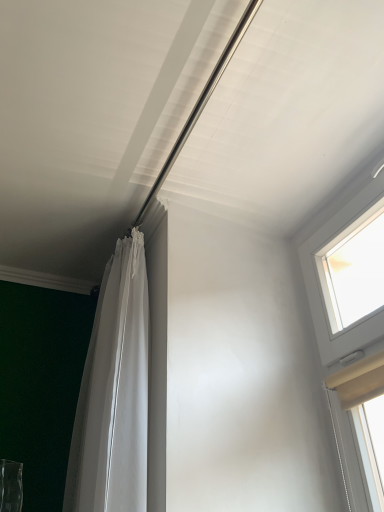
Measure the distance between white sheer curtain at left and camera.

white sheer curtain at left and camera are 36.81 inches apart.

The height and width of the screenshot is (512, 384). Describe the element at coordinates (114, 393) in the screenshot. I see `white sheer curtain at left` at that location.

Find the location of a particular element. white sheer curtain at left is located at coordinates (114, 393).

You are a GUI agent. You are given a task and a screenshot of the screen. Output one action in this format:
    pyautogui.click(x=<x>, y=<y>)
    Task: Click on the white sheer curtain at left
    
    Given the screenshot: What is the action you would take?
    pyautogui.click(x=114, y=393)